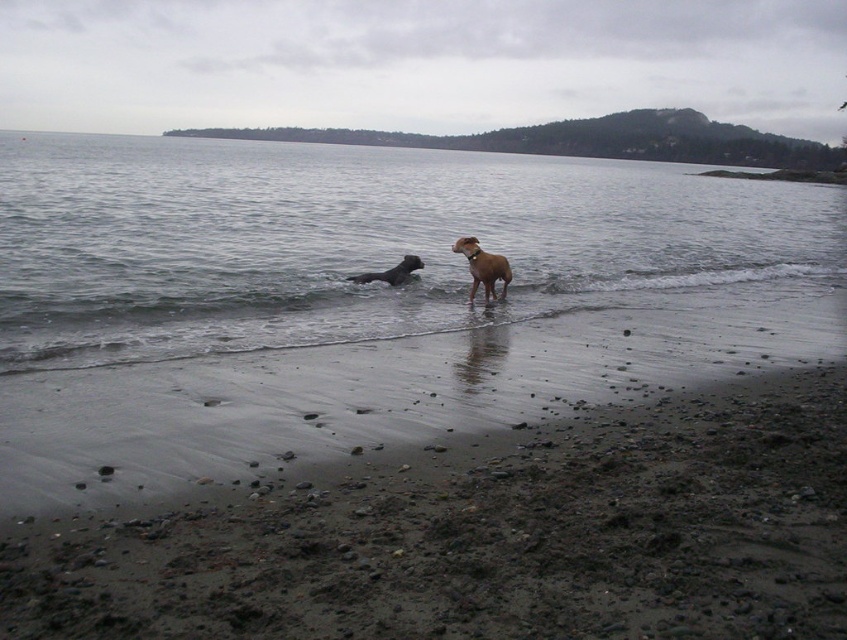
Question: Observing the image, what is the correct spatial positioning of clear water at center in reference to shiny black dog at center?

Choices:
 (A) above
 (B) below

Answer: (A)

Question: Which point appears closest to the camera in this image?

Choices:
 (A) (497, 268)
 (B) (390, 275)
 (C) (435, 156)

Answer: (A)

Question: In this image, where is clear water at center located relative to brown furry dog at center?

Choices:
 (A) left
 (B) right

Answer: (B)

Question: Which object is positioned farthest from the clear water at center?

Choices:
 (A) shiny black dog at center
 (B) brown furry dog at center

Answer: (B)

Question: Can you confirm if brown furry dog at center is positioned below shiny black dog at center?

Choices:
 (A) yes
 (B) no

Answer: (A)

Question: Which object is farther from the camera taking this photo?

Choices:
 (A) clear water at center
 (B) shiny black dog at center

Answer: (B)